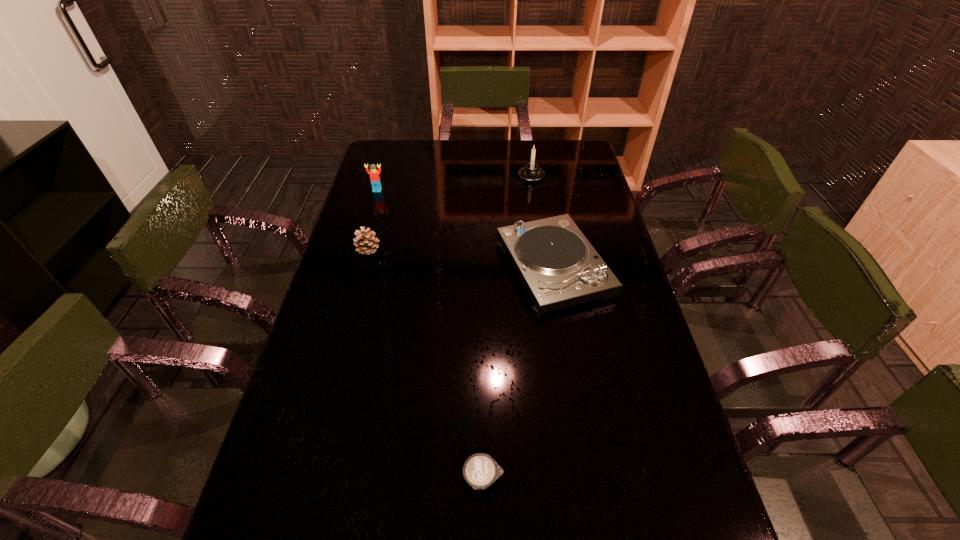
Where is `vacant space at the far right corner of the desktop`? This screenshot has height=540, width=960. vacant space at the far right corner of the desktop is located at coordinates (560, 164).

Identify the location of empty location between the record player and the yogurt. (518, 373).

I want to click on vacant space that's between the candle holder and the nearest object, so click(507, 327).

You are a GUI agent. You are given a task and a screenshot of the screen. Output one action in this format:
    pyautogui.click(x=<x>, y=<y>)
    Task: Click on the free point between the third object from right to left and the record player
    The image size is (960, 540).
    Given the screenshot: What is the action you would take?
    pyautogui.click(x=518, y=373)

In order to click on vacant area between the third object from left to right and the record player in this screenshot , I will do `click(518, 373)`.

Locate an element on the screen. The width and height of the screenshot is (960, 540). free space between the pinecone and the candle holder is located at coordinates (449, 213).

Where is `free space between the candle holder and the Lego`? free space between the candle holder and the Lego is located at coordinates (454, 183).

Locate an element on the screen. The image size is (960, 540). free point between the record player and the pinecone is located at coordinates [x=461, y=259].

The width and height of the screenshot is (960, 540). In order to click on vacant region between the record player and the fourth nearest object in this screenshot , I will do `click(466, 230)`.

At what (x,y) coordinates should I click in order to perform the action: click on free space between the pinecone and the farthest object. Please return your answer as a coordinate pair (x, y). Looking at the image, I should click on (449, 213).